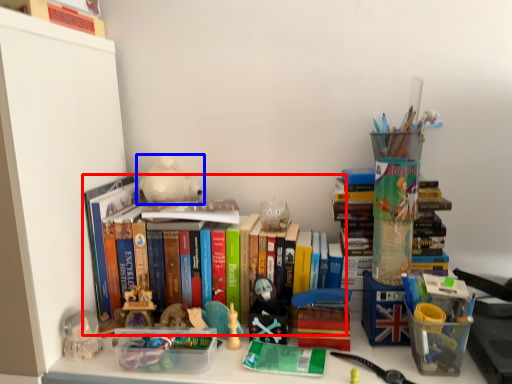
Question: Which object appears farthest to the camera in this image, book (highlighted by a red box) or toy (highlighted by a blue box)?

Choices:
 (A) book
 (B) toy

Answer: (B)